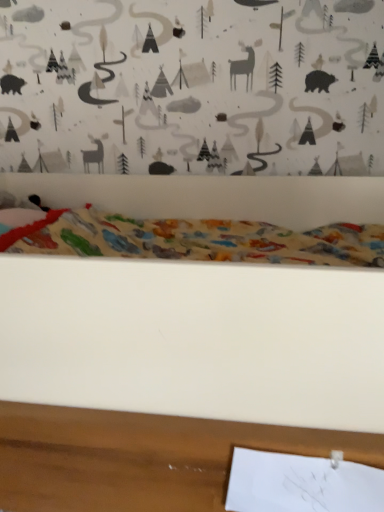
What do you see at coordinates (301, 483) in the screenshot? I see `white paper at bottom right` at bounding box center [301, 483].

At what (x,y) coordinates should I click in order to perform the action: click on white paper at bottom right. Please return your answer as a coordinate pair (x, y). The width and height of the screenshot is (384, 512). Looking at the image, I should click on (301, 483).

Measure the distance between white paper at bottom right and camera.

white paper at bottom right and camera are 60.60 centimeters apart.

Where is `white paper at bottom right`? The height and width of the screenshot is (512, 384). white paper at bottom right is located at coordinates (301, 483).